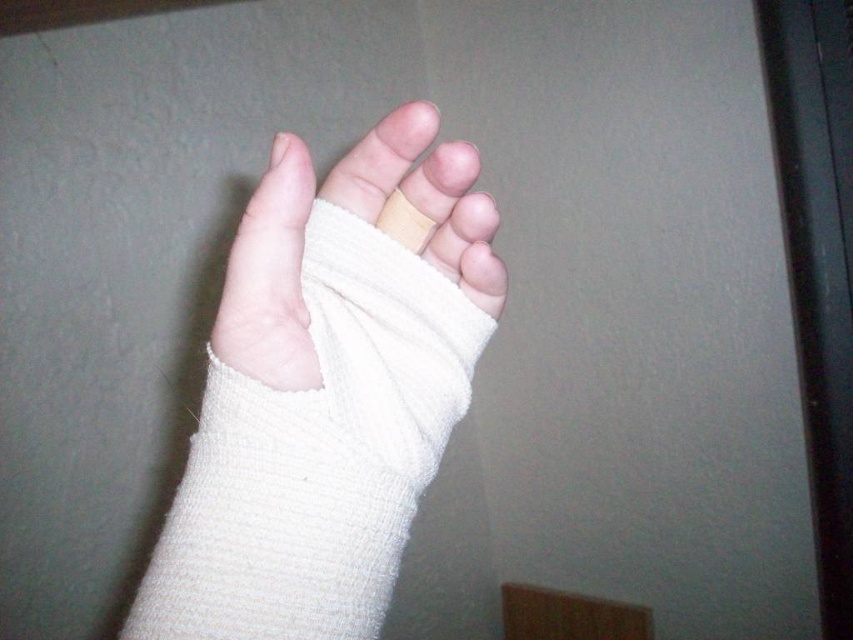
Can you confirm if white textured bandage at center is shorter than white bandage at center?

No.

Is white textured bandage at center further to camera compared to white bandage at center?

No.

The width and height of the screenshot is (853, 640). What do you see at coordinates (325, 394) in the screenshot?
I see `white textured bandage at center` at bounding box center [325, 394].

The image size is (853, 640). In order to click on white textured bandage at center in this screenshot , I will do [x=325, y=394].